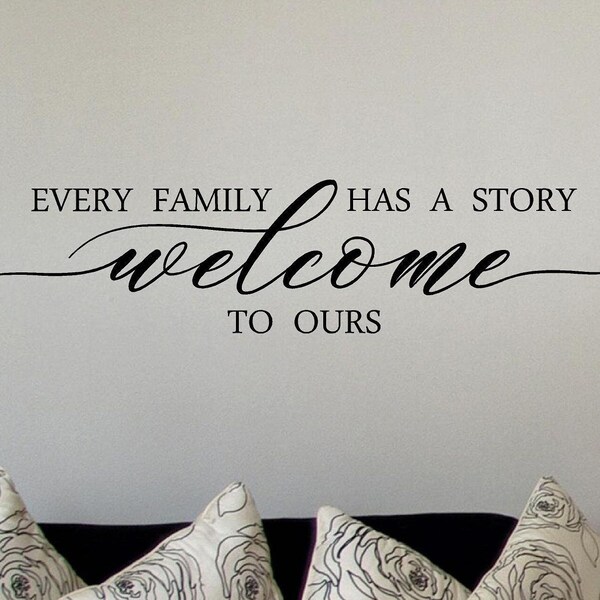
Image resolution: width=600 pixels, height=600 pixels. What are the coordinates of `cream colour on cushion` in the screenshot? It's located at (202, 543).